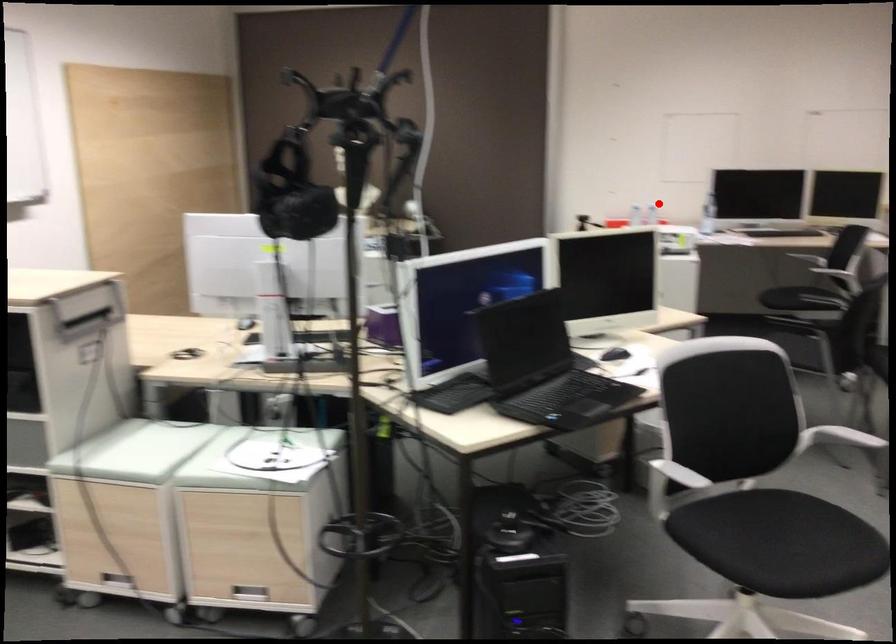
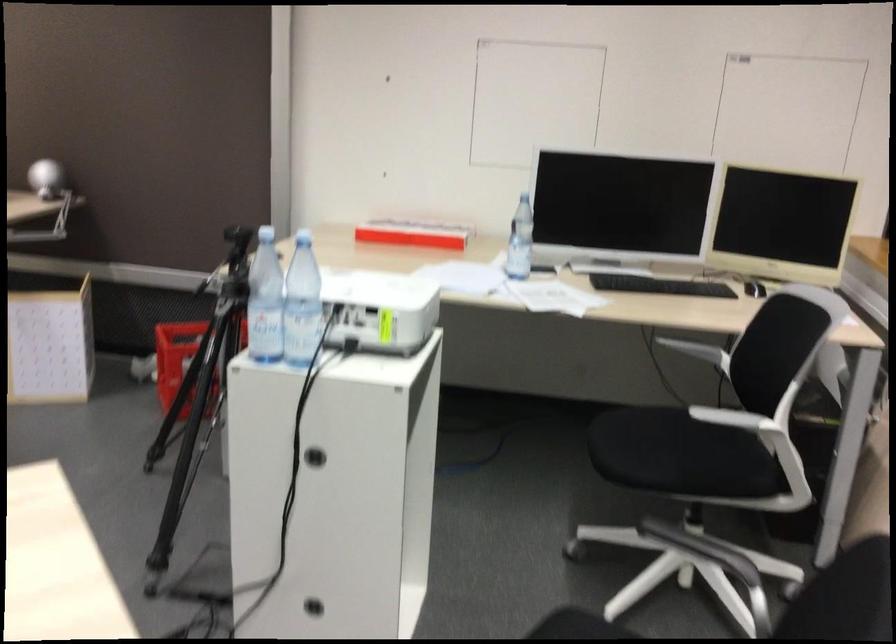
Question: I am providing you with two images of the same scene from different viewpoints. A red point is marked on the first image. Is the red point's position out of view in image 2?

Choices:
 (A) Yes
 (B) No

Answer: (B)